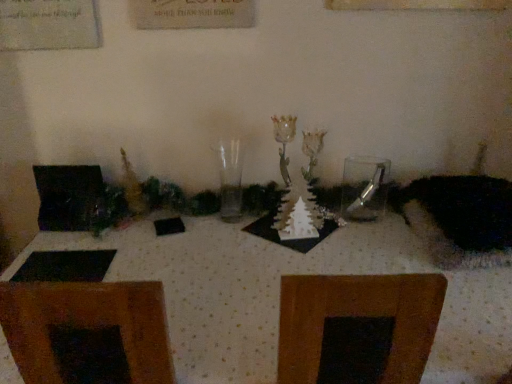
Question: Is clear glass spoon at center facing away from fuzzy black cat at right?

Choices:
 (A) no
 (B) yes

Answer: (A)

Question: Considering the relative positions of clear glass spoon at center and fuzzy black cat at right in the image provided, is clear glass spoon at center to the right of fuzzy black cat at right from the viewer's perspective?

Choices:
 (A) yes
 (B) no

Answer: (B)

Question: Considering the relative positions of clear glass spoon at center and fuzzy black cat at right in the image provided, is clear glass spoon at center behind fuzzy black cat at right?

Choices:
 (A) no
 (B) yes

Answer: (B)

Question: Considering the relative positions of clear glass spoon at center and fuzzy black cat at right in the image provided, is clear glass spoon at center to the left of fuzzy black cat at right from the viewer's perspective?

Choices:
 (A) yes
 (B) no

Answer: (A)

Question: From the image's perspective, is clear glass spoon at center located above fuzzy black cat at right?

Choices:
 (A) no
 (B) yes

Answer: (B)

Question: Does clear glass spoon at center come in front of fuzzy black cat at right?

Choices:
 (A) yes
 (B) no

Answer: (B)

Question: Are clear glass spoon at center and white dotted fabric at center located far from each other?

Choices:
 (A) no
 (B) yes

Answer: (A)

Question: Does clear glass spoon at center lie in front of white dotted fabric at center?

Choices:
 (A) yes
 (B) no

Answer: (B)

Question: From the image's perspective, is clear glass spoon at center located beneath white dotted fabric at center?

Choices:
 (A) yes
 (B) no

Answer: (B)

Question: From a real-world perspective, is clear glass spoon at center beneath white dotted fabric at center?

Choices:
 (A) yes
 (B) no

Answer: (B)

Question: From the image's perspective, is clear glass spoon at center over white dotted fabric at center?

Choices:
 (A) no
 (B) yes

Answer: (B)

Question: Is clear glass spoon at center at the left side of white dotted fabric at center?

Choices:
 (A) yes
 (B) no

Answer: (B)

Question: Would you say fuzzy black cat at right is outside transparent glass vase at center?

Choices:
 (A) no
 (B) yes

Answer: (B)